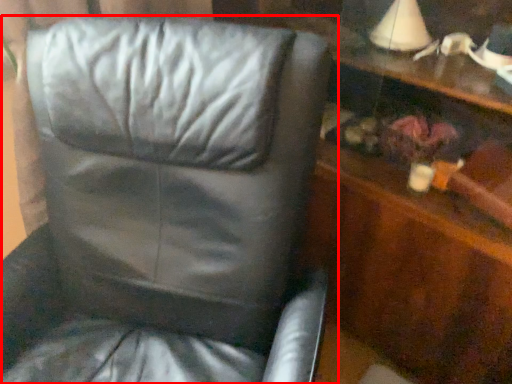
Question: In this image, where is chair (annotated by the red box) located relative to dresser?

Choices:
 (A) left
 (B) right

Answer: (A)